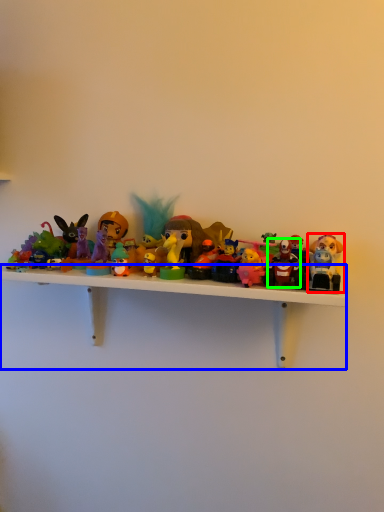
Question: Which object is the closest to the toy (highlighted by a red box)? Choose among these: shelf (highlighted by a blue box) or toy (highlighted by a green box).

Choices:
 (A) shelf
 (B) toy

Answer: (B)